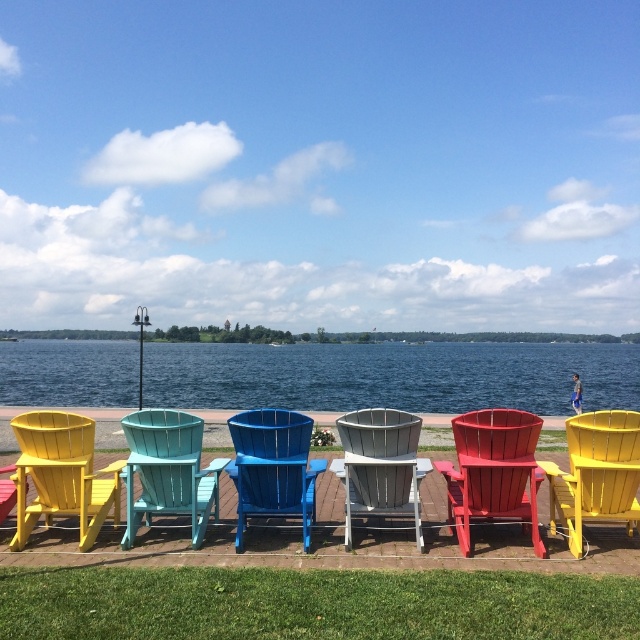
You are sitting on the white wood beach chair at center and want to move to the teal wood beach chair at center. Which direction should you move to reach it?

The teal wood beach chair at center is located below the white wood beach chair at center, so you should move downward to reach it.